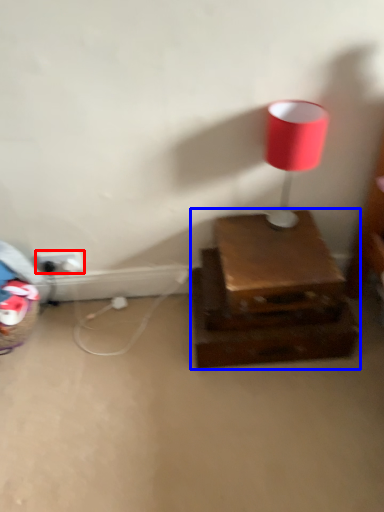
Question: Which of the following is the closest to the observer, electric outlet (highlighted by a red box) or furniture (highlighted by a blue box)?

Choices:
 (A) electric outlet
 (B) furniture

Answer: (B)